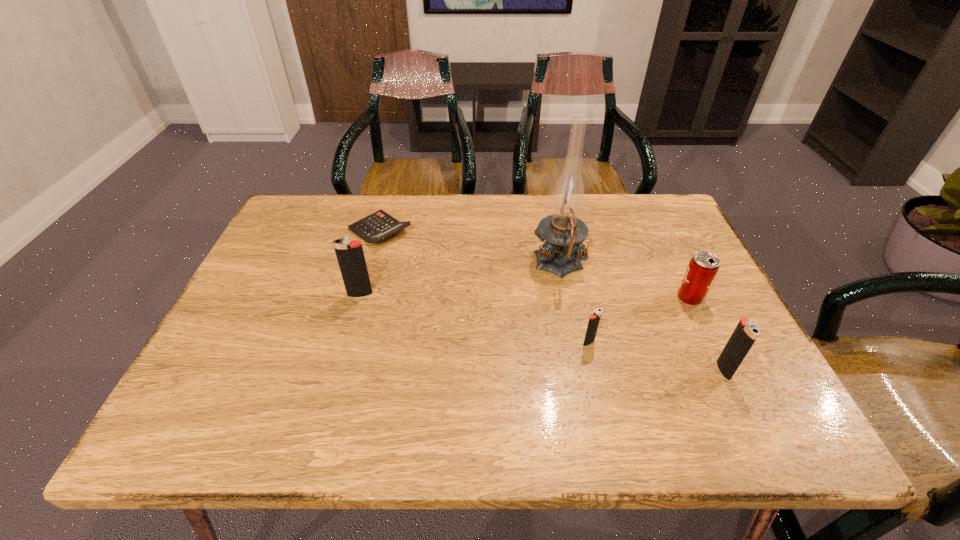
To ensure equal spacing by inserting another igniter among them, please point out a vacant spot for this new igniter. Please provide its 2D coordinates. Your answer should be formatted as a tuple, i.e. [(x, y)], where the tuple contains the x and y coordinates of a point satisfying the conditions above.

[(468, 317)]